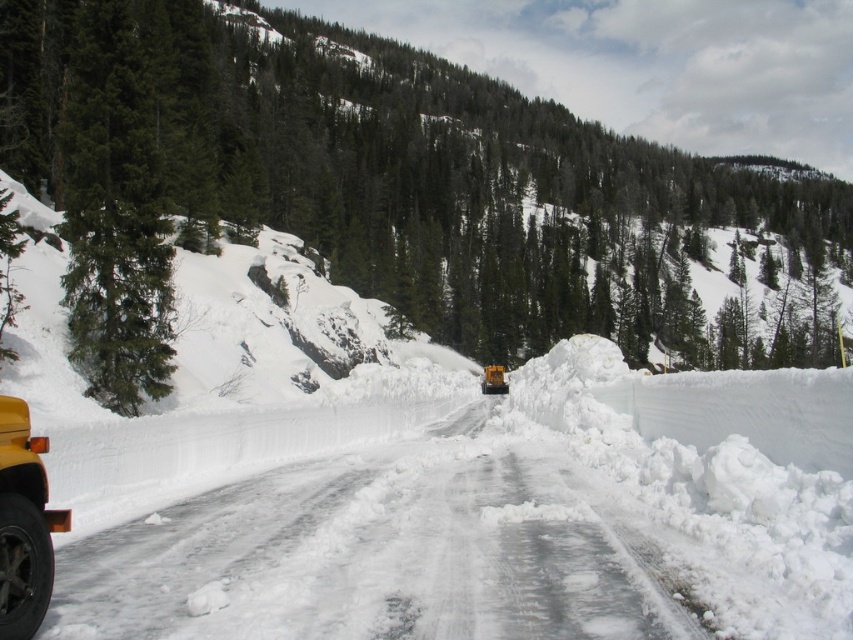
Who is positioned more to the right, white snow-packed road at center or green matte tree at left?

From the viewer's perspective, white snow-packed road at center appears more on the right side.

Describe the element at coordinates (375, 554) in the screenshot. I see `white snow-packed road at center` at that location.

Is point (242, 548) farther from viewer compared to point (73, 323)?

No, (242, 548) is in front of (73, 323).

Where is `white snow-packed road at center`? This screenshot has height=640, width=853. white snow-packed road at center is located at coordinates (375, 554).

Between point (248, 179) and point (486, 385), which one is positioned in front?

Point (248, 179) is more forward.

Is point (154, 113) less distant than point (492, 371)?

Yes, it is.

You are a GUI agent. You are given a task and a screenshot of the screen. Output one action in this format:
    pyautogui.click(x=<x>, y=<y>)
    Task: Click on the green textured tree at upper left
    This screenshot has height=640, width=853.
    Given the screenshot: What is the action you would take?
    pyautogui.click(x=450, y=180)

Is point (22, 566) in front of point (500, 369)?

Yes, it is in front of point (500, 369).

The image size is (853, 640). Describe the element at coordinates (24, 524) in the screenshot. I see `yellow rubber plow at left` at that location.

Identify the location of yellow rubber plow at left. (24, 524).